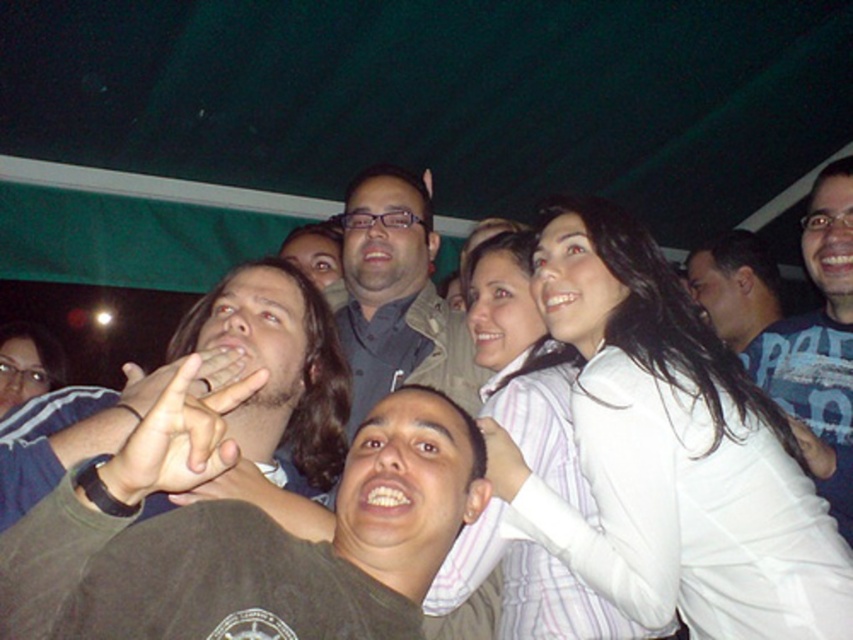
Question: Which object is the farthest from the matte gray shirt at center?

Choices:
 (A) blue shirt at upper right
 (B) white striped shirt at upper right
 (C) brown leather hand at center

Answer: (A)

Question: Does matte gray shirt at center have a greater width compared to brown leather hand at center?

Choices:
 (A) no
 (B) yes

Answer: (B)

Question: Is matte gray shirt at center positioned in front of brown leather hand at center?

Choices:
 (A) yes
 (B) no

Answer: (B)

Question: Which of the following is the farthest from the observer?

Choices:
 (A) (712, 276)
 (B) (697, 528)

Answer: (A)

Question: Which of the following is the farthest from the observer?

Choices:
 (A) (169, 461)
 (B) (764, 321)

Answer: (B)

Question: Can you confirm if white striped shirt at upper right is positioned to the left of matte gray shirt at center?

Choices:
 (A) yes
 (B) no

Answer: (B)